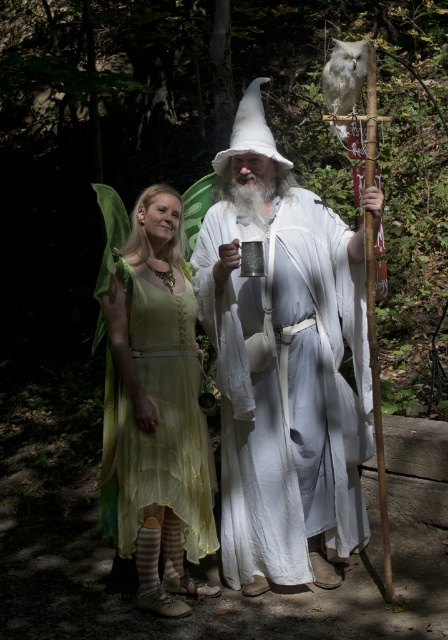
From the picture: You are a photographer trying to capture both the white cotton wizard at center and the matte yellow dress at center in a single frame. Given that the wizard is above the dress, where should you position your camera to ensure both are visible?

Since the white cotton wizard at center is located above the matte yellow dress at center, you should position your camera at a lower angle to capture both in the frame.

Please look at the image and identify the object located at the coordinate point (284,365). The scene has two people in fantasy costumes in a wooded area. The first is a woman in a green dress with a cape and fairy wings, and the second is a wizard in a white robe with a staff. Which of the two individuals is at this coordinate?

The point at coordinate (284,365) indicates the white cotton wizard at center.